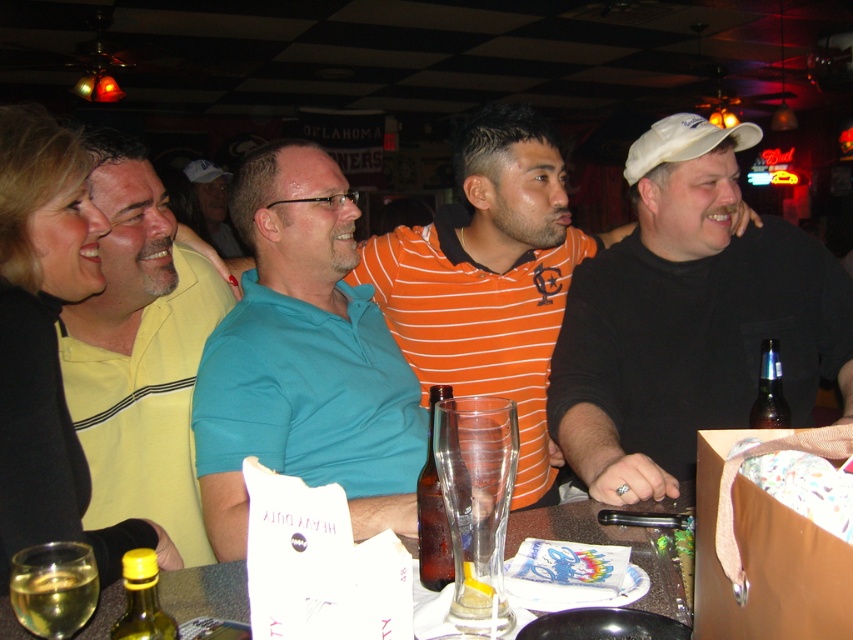
Based on the photo, you are a photographer at the event and want to take a photo of the teal polo shirt at center and the translucent glass at center. Which object will appear larger in the photo?

The teal polo shirt at center will appear larger in the photo because it is taller than the translucent glass at center.

You are a waiter in a restaurant. You need to deliver a drink to the customer wearing the matte teal shirt at center, who is seated at a table. The customer is 3.40 meters away from you. Can you reach them without moving past the black matte shirt at right, which is blocking your path?

The distance between the black matte shirt at right and the matte teal shirt at center is 3.40 meters. Since the black matte shirt at right is blocking your path, you would need to navigate around it, but the question specifies not moving past it. Therefore, you cannot reach the matte teal shirt at center without moving past the black matte shirt at right.